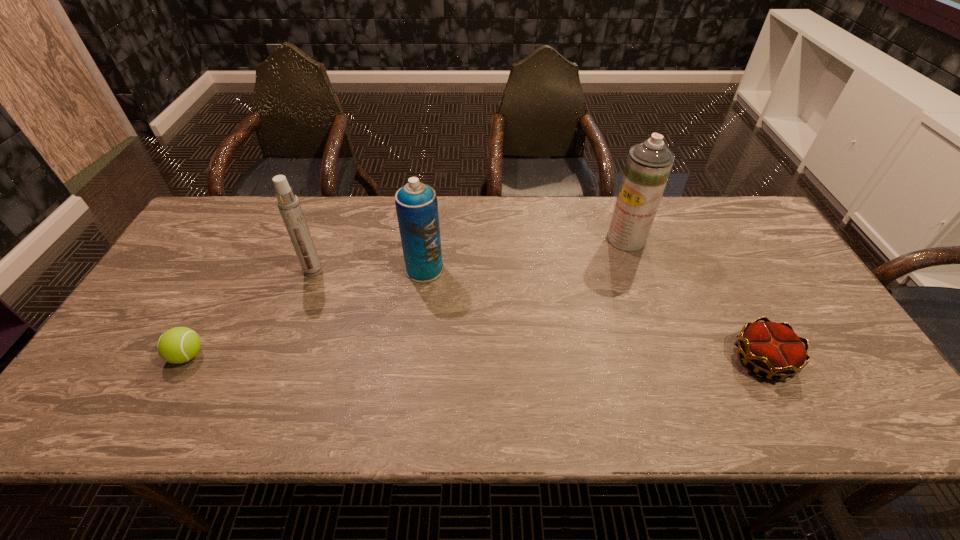
The image size is (960, 540). Identify the location of vacant area between the fourth object from right to left and the crown. (538, 315).

Identify the location of vacant region between the farthest aerosol can and the leftmost object. This screenshot has width=960, height=540. (407, 298).

The image size is (960, 540). Identify the location of free area in between the third object from left to right and the rightmost object. (593, 314).

Where is `vacant area between the rightmost object and the leftmost aerosol can`? The image size is (960, 540). vacant area between the rightmost object and the leftmost aerosol can is located at coordinates (538, 315).

The height and width of the screenshot is (540, 960). I want to click on empty space that is in between the tennis ball and the second aerosol can from right to left, so click(306, 312).

The image size is (960, 540). I want to click on vacant region between the second object from left to right and the tennis ball, so click(x=251, y=313).

Where is `free space between the second aerosol can from left to right and the fourth object from right to left`? free space between the second aerosol can from left to right and the fourth object from right to left is located at coordinates (369, 270).

Where is `empty space that is in between the tennis ball and the third object from left to right`? empty space that is in between the tennis ball and the third object from left to right is located at coordinates (306, 312).

I want to click on free spot between the rightmost aerosol can and the crown, so click(x=694, y=299).

In order to click on the second closest object relative to the third object from right to left in this screenshot , I will do `click(177, 345)`.